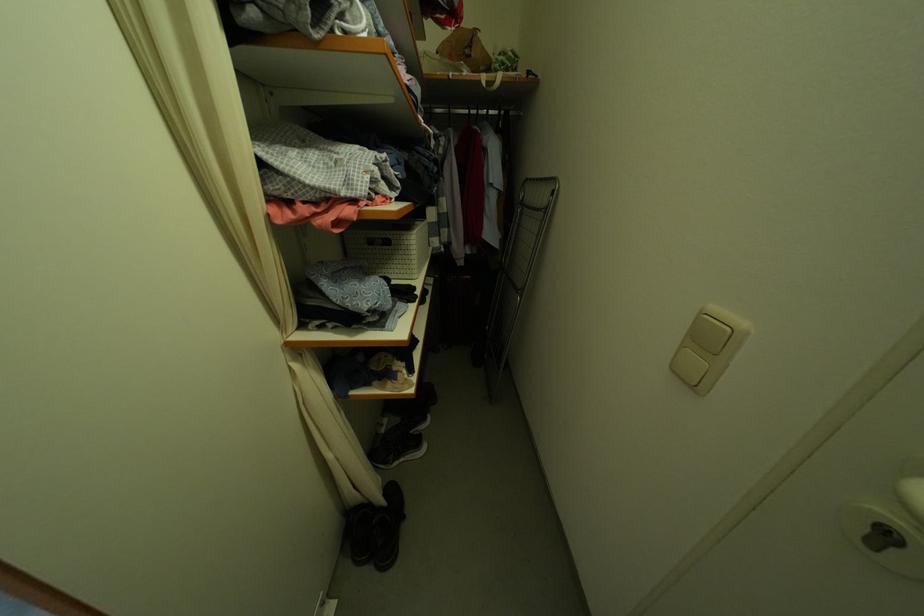
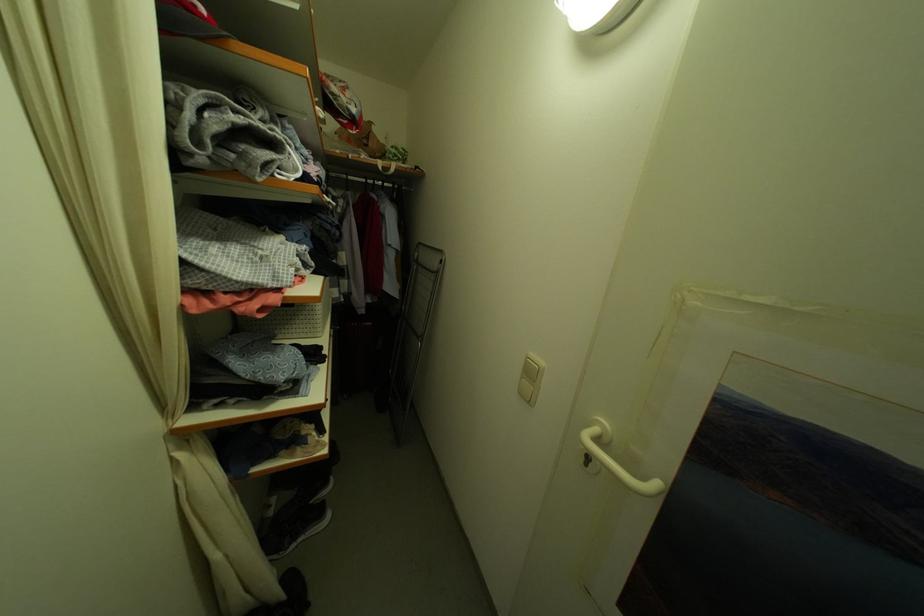
Question: The images are taken continuously from a first-person perspective. In which direction is your viewpoint rotating?

Choices:
 (A) Left
 (B) Right
 (C) Up
 (D) Down

Answer: (B)